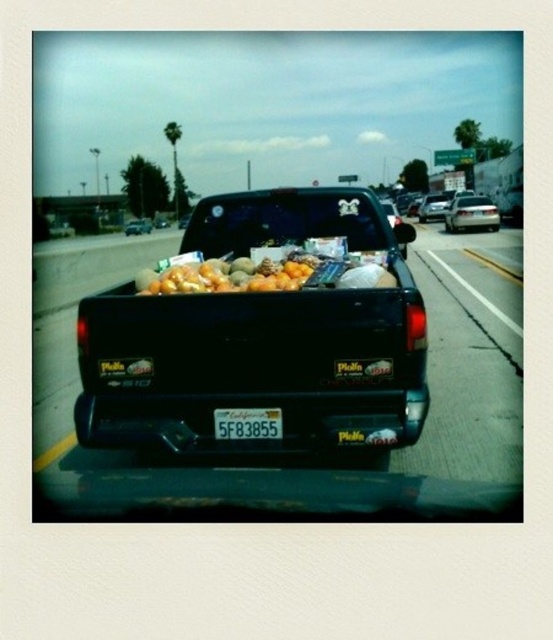
Which is more to the right, orange matte melons at center or white plastic license plate at center?

From the viewer's perspective, white plastic license plate at center appears more on the right side.

Between point (247, 273) and point (253, 432), which one is positioned in front?

Positioned in front is point (253, 432).

The image size is (553, 640). What are the coordinates of `orange matte melons at center` in the screenshot? It's located at (228, 275).

Is black matte truck bed at center positioned in front of orange matte melons at center?

Yes, black matte truck bed at center is in front of orange matte melons at center.

In the scene shown: Who is more distant from viewer, (273,356) or (221,282)?

Point (221,282)

This screenshot has height=640, width=553. Identify the location of black matte truck bed at center. (263, 332).

Is black matte truck bed at center to the right of white plastic license plate at center from the viewer's perspective?

Yes, black matte truck bed at center is to the right of white plastic license plate at center.

Can you confirm if black matte truck bed at center is positioned below white plastic license plate at center?

Incorrect, black matte truck bed at center is not positioned below white plastic license plate at center.

What are the coordinates of `black matte truck bed at center` in the screenshot? It's located at (263, 332).

Where is `black matte truck bed at center`? The height and width of the screenshot is (640, 553). black matte truck bed at center is located at coordinates (263, 332).